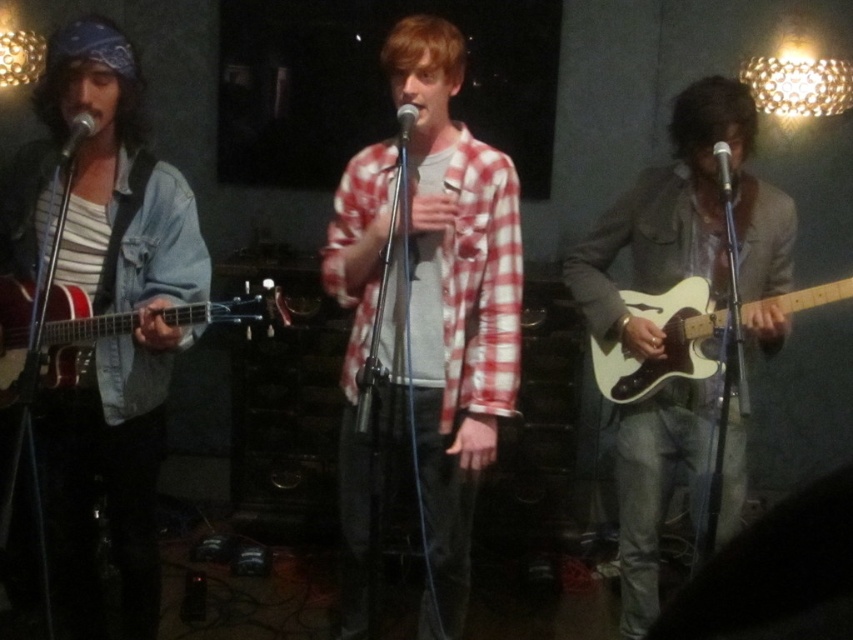
Question: Where is white matte electric guitar at right located in relation to matte black microphone at center in the image?

Choices:
 (A) right
 (B) left

Answer: (A)

Question: Which point is closer to the camera?

Choices:
 (A) metallic silver microphone at center
 (B) matte black microphone at center
 (C) matte black electric guitar at left

Answer: (C)

Question: Among these objects, which one is nearest to the camera?

Choices:
 (A) white matte electric guitar at right
 (B) metallic silver microphone at center

Answer: (A)

Question: Where is checkered fabric shirt at center located in relation to matte black microphone at left in the image?

Choices:
 (A) below
 (B) above

Answer: (A)

Question: Is metallic silver microphone at center thinner than matte black microphone at center?

Choices:
 (A) yes
 (B) no

Answer: (B)

Question: Which point is farther to the camera?

Choices:
 (A) (86, 333)
 (B) (602, 340)

Answer: (B)